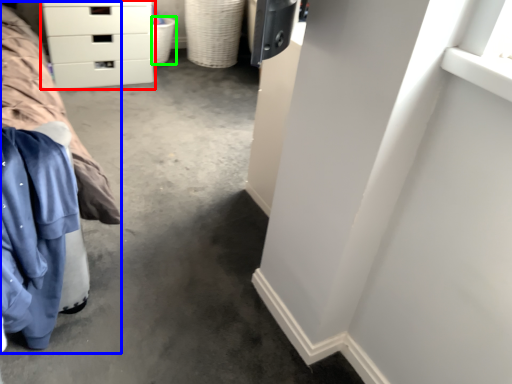
Question: Considering the real-world distances, which object is closest to chest of drawers (highlighted by a red box)? bed (highlighted by a blue box) or basket (highlighted by a green box).

Choices:
 (A) bed
 (B) basket

Answer: (B)